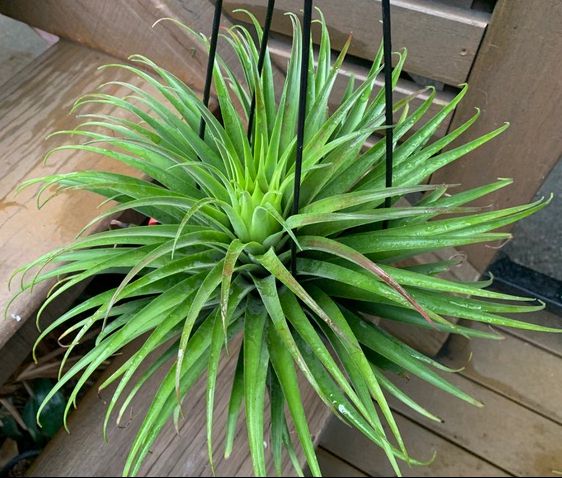
Where is `doorstop black`? The height and width of the screenshot is (478, 562). doorstop black is located at coordinates (541, 287).